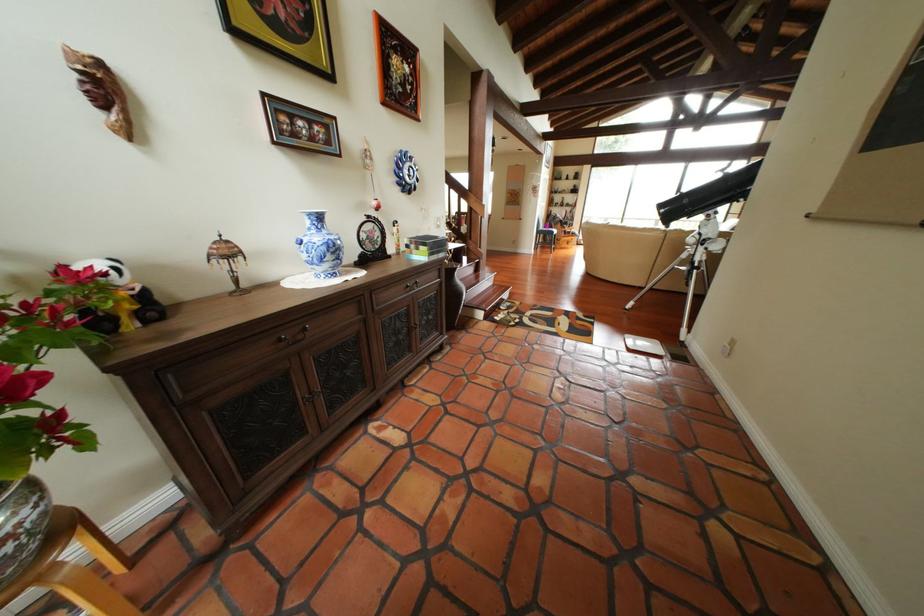
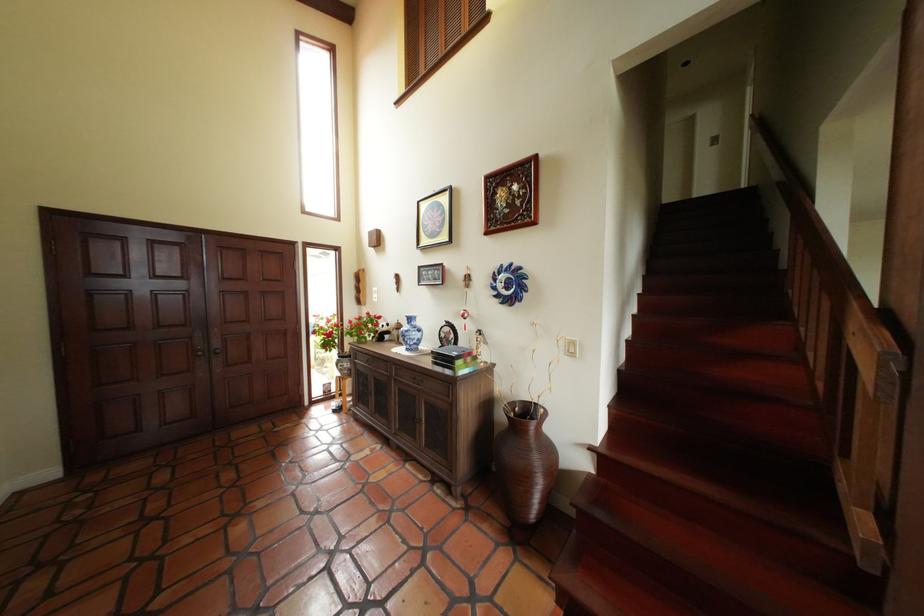
Locate, in the second image, the point that corresponds to point (444, 249) in the first image.

(448, 360)